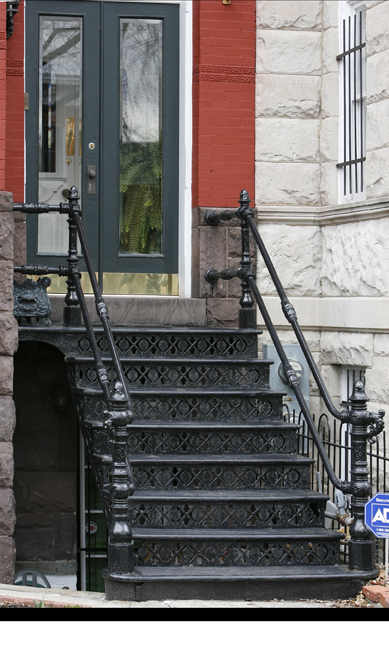
What are the coordinates of `glass panel` in the screenshot? It's located at (141, 155).